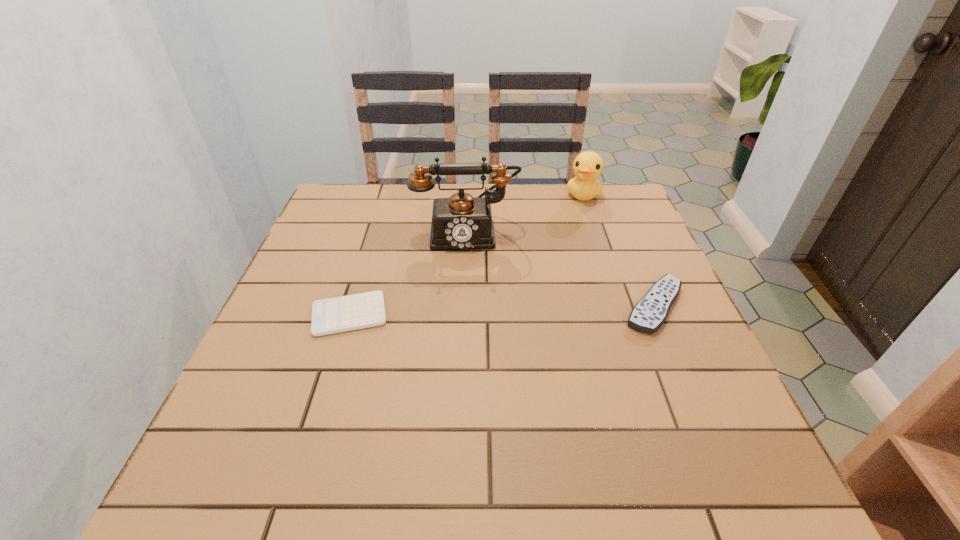
Locate an element on the screen. This screenshot has width=960, height=540. free spot on the desktop that is between the leftmost object and the second shortest object and is positioned on the front of the tallest object at the rotary dial is located at coordinates tap(468, 311).

This screenshot has height=540, width=960. In order to click on free space on the desktop that is between the calculator and the remote control and is positioned on the face of the duck in this screenshot , I will do `click(548, 309)`.